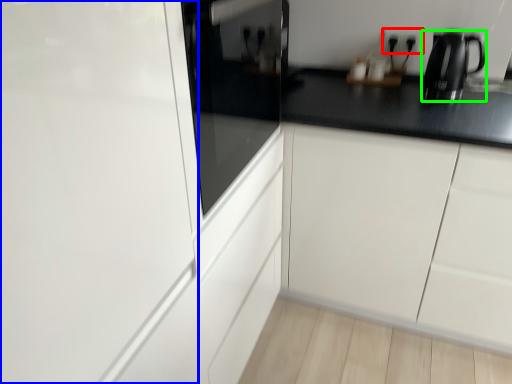
Question: Which is farther away from electric outlet (highlighted by a red box)? glass door (highlighted by a blue box) or kitchen appliance (highlighted by a green box)?

Choices:
 (A) glass door
 (B) kitchen appliance

Answer: (A)